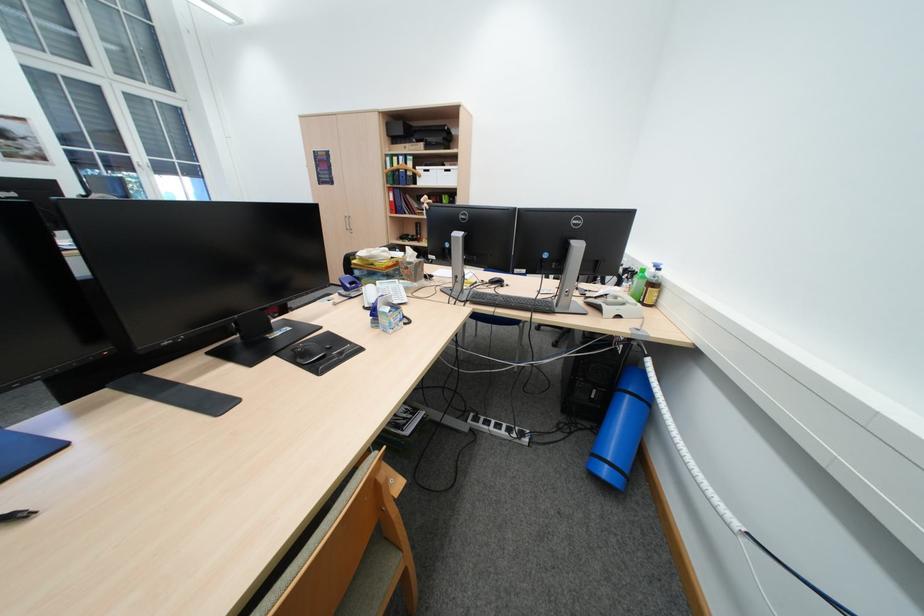
I want to click on blue binder, so click(399, 169).